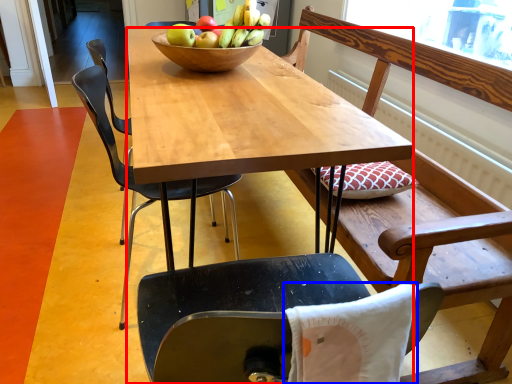
Question: Which of the following is the farthest to the observer, desk (highlighted by a red box) or pillow (highlighted by a blue box)?

Choices:
 (A) desk
 (B) pillow

Answer: (A)